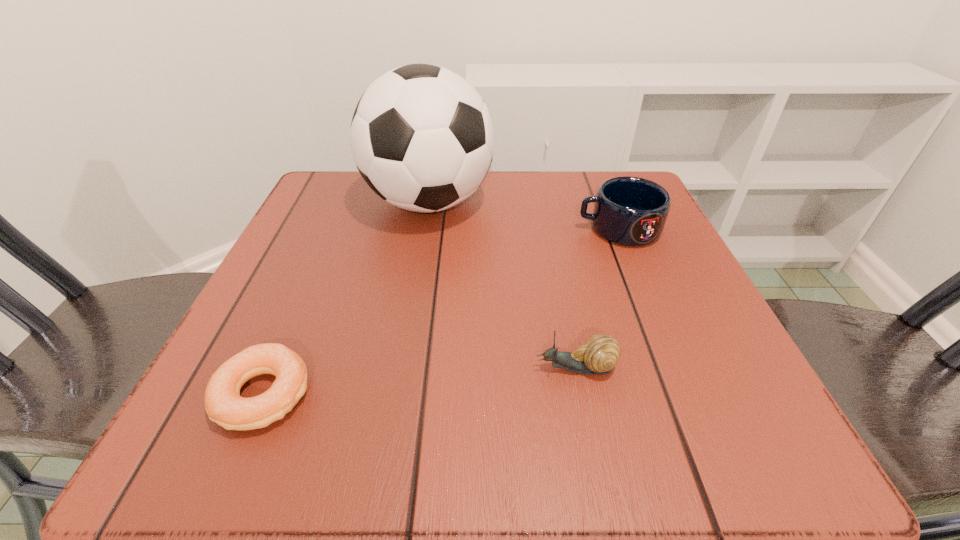
Locate an element on the screen. The width and height of the screenshot is (960, 540). object at the far left corner is located at coordinates (422, 138).

I want to click on object that is at the near left corner, so click(x=224, y=405).

This screenshot has height=540, width=960. I want to click on object present at the far right corner, so click(x=631, y=211).

Where is `free region at the far edge of the desktop`? free region at the far edge of the desktop is located at coordinates (529, 171).

Identify the location of vacant space at the left edge of the desktop. (345, 241).

Where is `free space at the right edge`? This screenshot has width=960, height=540. free space at the right edge is located at coordinates (643, 390).

Image resolution: width=960 pixels, height=540 pixels. Identify the location of free space at the far left corner of the desktop. (303, 221).

The image size is (960, 540). In order to click on free region at the near left corner of the desktop in this screenshot , I will do `click(237, 431)`.

The image size is (960, 540). In the image, there is a desktop. Identify the location of free space at the far right corner. (587, 172).

At what (x,y) coordinates should I click in order to perform the action: click on vacant point located between the bagel and the rightmost object. Please return your answer as a coordinate pair (x, y). Looking at the image, I should click on (441, 312).